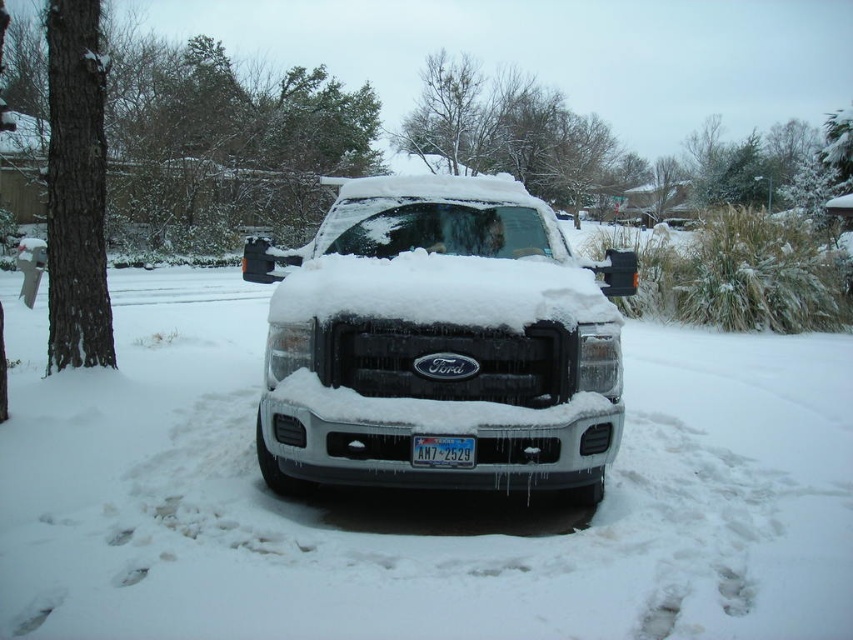
How much distance is there between white matte truck at center and white plastic license plate at center?

white matte truck at center is 30.57 inches away from white plastic license plate at center.

Does white matte truck at center appear over white plastic license plate at center?

Indeed, white matte truck at center is positioned over white plastic license plate at center.

The image size is (853, 640). In order to click on white matte truck at center in this screenshot , I will do `click(439, 340)`.

You are a GUI agent. You are given a task and a screenshot of the screen. Output one action in this format:
    pyautogui.click(x=<x>, y=<y>)
    Task: Click on the white matte truck at center
    This screenshot has height=640, width=853.
    Given the screenshot: What is the action you would take?
    pyautogui.click(x=439, y=340)